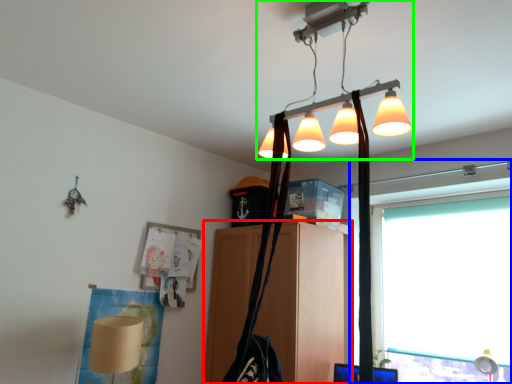
Question: Which object is the closest to the furniture (highlighted by a red box)? Choose among these: window (highlighted by a blue box) or lamp (highlighted by a green box).

Choices:
 (A) window
 (B) lamp

Answer: (A)